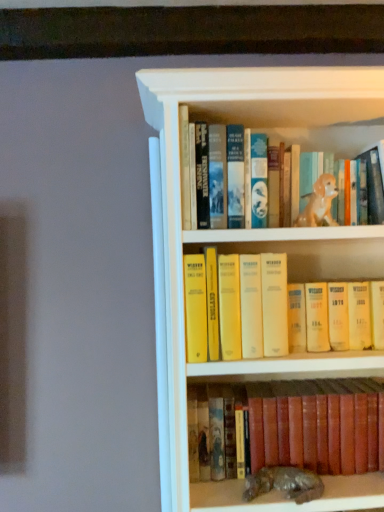
Question: Does shiny metallic statue at lower center, which is the 1th animal in bottom-to-top order, come behind yellow paperbacks at center, the 2th book positioned from the bottom?

Choices:
 (A) no
 (B) yes

Answer: (A)

Question: Is shiny metallic statue at lower center, which is the 1th animal in bottom-to-top order, bigger than yellow paperbacks at center, the 2th book positioned from the bottom?

Choices:
 (A) yes
 (B) no

Answer: (B)

Question: Is shiny metallic statue at lower center, which is the 1th animal in bottom-to-top order, outside yellow paperbacks at center, acting as the first book starting from the top?

Choices:
 (A) no
 (B) yes

Answer: (B)

Question: Considering the relative sizes of shiny metallic statue at lower center, which is the 1th animal in bottom-to-top order, and yellow paperbacks at center, acting as the first book starting from the top, in the image provided, is shiny metallic statue at lower center, which is the 1th animal in bottom-to-top order, taller than yellow paperbacks at center, acting as the first book starting from the top,?

Choices:
 (A) no
 (B) yes

Answer: (A)

Question: Does shiny metallic statue at lower center, which is the second animal in top-to-bottom order, turn towards yellow paperbacks at center, the 2th book positioned from the bottom?

Choices:
 (A) no
 (B) yes

Answer: (A)

Question: Considering the positions of point coord(344,384) and point coord(327,197), is point coord(344,384) closer or farther from the camera than point coord(327,197)?

Choices:
 (A) closer
 (B) farther

Answer: (B)

Question: Is leather-bound book at lower center, which ranks as the second book in top-to-bottom order, wider or thinner than golden ceramic dog at upper center, acting as the 1th animal starting from the top?

Choices:
 (A) thin
 (B) wide

Answer: (B)

Question: Based on their positions, is leather-bound book at lower center, which ranks as the second book in top-to-bottom order, located to the left or right of golden ceramic dog at upper center, acting as the 1th animal starting from the top?

Choices:
 (A) left
 (B) right

Answer: (A)

Question: Is leather-bound book at lower center, which is the 1th book in bottom-to-top order, in front of or behind golden ceramic dog at upper center, which is the 2th animal in bottom-to-top order, in the image?

Choices:
 (A) front
 (B) behind

Answer: (B)

Question: Considering the positions of yellow paperbacks at center, acting as the first book starting from the top, and shiny metallic statue at lower center, which is the 1th animal in bottom-to-top order, in the image, is yellow paperbacks at center, acting as the first book starting from the top, taller or shorter than shiny metallic statue at lower center, which is the 1th animal in bottom-to-top order,?

Choices:
 (A) short
 (B) tall

Answer: (B)

Question: Is yellow paperbacks at center, the 2th book positioned from the bottom, to the left or to the right of shiny metallic statue at lower center, which is the 1th animal in bottom-to-top order, in the image?

Choices:
 (A) left
 (B) right

Answer: (A)

Question: Choose the correct answer: Is yellow paperbacks at center, the 2th book positioned from the bottom, inside shiny metallic statue at lower center, which is the 1th animal in bottom-to-top order, or outside it?

Choices:
 (A) outside
 (B) inside

Answer: (A)

Question: In terms of size, does yellow paperbacks at center, the 2th book positioned from the bottom, appear bigger or smaller than shiny metallic statue at lower center, which is the second animal in top-to-bottom order?

Choices:
 (A) small
 (B) big

Answer: (B)

Question: From the image's perspective, is leather-bound book at lower center, which is the 1th book in bottom-to-top order, located above or below yellow paperbacks at center, the 2th book positioned from the bottom?

Choices:
 (A) above
 (B) below

Answer: (B)

Question: Is leather-bound book at lower center, which is the 1th book in bottom-to-top order, in front of or behind yellow paperbacks at center, acting as the first book starting from the top, in the image?

Choices:
 (A) front
 (B) behind

Answer: (B)